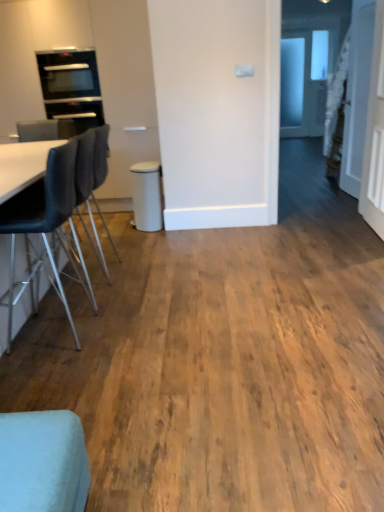
Question: From a real-world perspective, is black glass oven at upper left below black leather chair at left, the first chair from the back?

Choices:
 (A) yes
 (B) no

Answer: (B)

Question: Is the position of black glass oven at upper left less distant than that of black leather chair at left, the first chair from the back?

Choices:
 (A) no
 (B) yes

Answer: (A)

Question: Is black glass oven at upper left further to camera compared to black leather chair at left, the 3th chair in the front-to-back sequence?

Choices:
 (A) yes
 (B) no

Answer: (A)

Question: Can you confirm if black glass oven at upper left is smaller than black leather chair at left, the first chair from the back?

Choices:
 (A) yes
 (B) no

Answer: (A)

Question: Is black glass oven at upper left positioned far away from black leather chair at left, the 3th chair in the front-to-back sequence?

Choices:
 (A) yes
 (B) no

Answer: (A)

Question: From their relative heights in the image, would you say matte white bar stool at center is taller or shorter than black glass oven at upper left?

Choices:
 (A) short
 (B) tall

Answer: (B)

Question: Is matte white bar stool at center wider or thinner than black glass oven at upper left?

Choices:
 (A) thin
 (B) wide

Answer: (A)

Question: Considering the relative positions of matte white bar stool at center and black glass oven at upper left in the image provided, is matte white bar stool at center to the left or to the right of black glass oven at upper left?

Choices:
 (A) right
 (B) left

Answer: (A)

Question: From a real-world perspective, is matte white bar stool at center above or below black glass oven at upper left?

Choices:
 (A) above
 (B) below

Answer: (B)

Question: Does point (94, 60) appear closer or farther from the camera than point (158, 183)?

Choices:
 (A) closer
 (B) farther

Answer: (B)

Question: Relative to matte white bar stool at center, is black glass oven at upper left in front or behind?

Choices:
 (A) front
 (B) behind

Answer: (B)

Question: Looking at their shapes, would you say black glass oven at upper left is wider or thinner than matte white bar stool at center?

Choices:
 (A) thin
 (B) wide

Answer: (B)

Question: From the image's perspective, is black glass oven at upper left positioned above or below matte white bar stool at center?

Choices:
 (A) below
 (B) above

Answer: (B)

Question: Relative to white glossy door at upper right, is light blue fabric chair at lower left, marked as the first chair in a front-to-back arrangement, in front or behind?

Choices:
 (A) front
 (B) behind

Answer: (A)

Question: Is light blue fabric chair at lower left, marked as the first chair in a front-to-back arrangement, spatially inside white glossy door at upper right, or outside of it?

Choices:
 (A) outside
 (B) inside

Answer: (A)